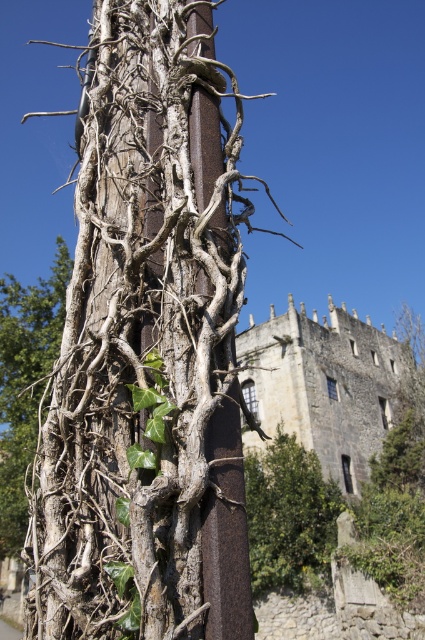
You are an artist sketching this scene and need to ensure proportions are accurate. Given the rusty wood tree trunk at left and the dry wood vine at left, which one is taller?

The dry wood vine at left is taller than the rusty wood tree trunk at left.

You are an artist sketching the scene and need to decide which area to focus on first. Since you want to capture the most visually dominant element, which object should you start with, the rusty wood tree trunk at left or the dry wood vine at left?

The dry wood vine at left should be focused on first because it occupies more space than the rusty wood tree trunk at left according to the description.